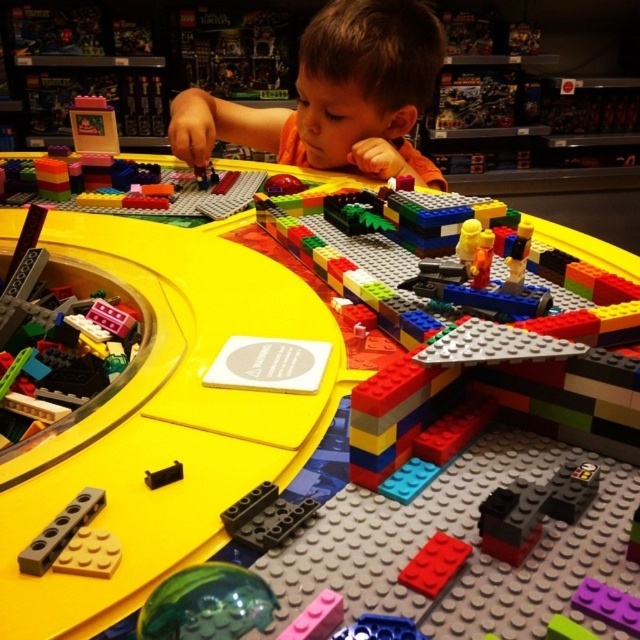
Question: Which object is the closest to the black matte brick at center?

Choices:
 (A) red matte brick at lower center
 (B) purple matte brick at lower right

Answer: (A)

Question: Is purple matte brick at lower right below blue plastic bricks at lower center?

Choices:
 (A) yes
 (B) no

Answer: (B)

Question: Which object is positioned farthest from the black matte brick at center?

Choices:
 (A) purple matte brick at lower right
 (B) brown hair at upper center

Answer: (B)

Question: Can you confirm if black matte brick at center is positioned to the left of purple matte brick at lower right?

Choices:
 (A) yes
 (B) no

Answer: (A)

Question: Does brown hair at upper center appear under green glossy ball at center?

Choices:
 (A) yes
 (B) no

Answer: (B)

Question: Which of the following is the closest to the observer?

Choices:
 (A) (429, 550)
 (B) (362, 616)

Answer: (B)